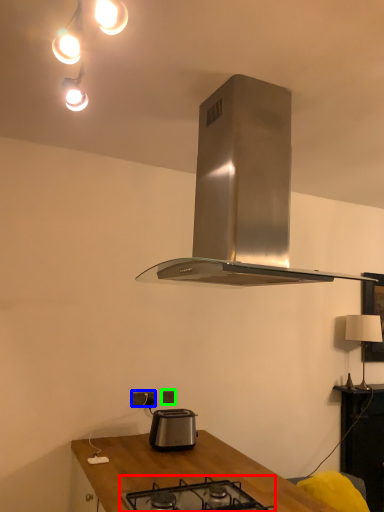
Question: Which object is the closest to the gas stove (highlighted by a red box)? Choose among these: power plugs and sockets (highlighted by a blue box) or power plugs and sockets (highlighted by a green box).

Choices:
 (A) power plugs and sockets
 (B) power plugs and sockets

Answer: (A)